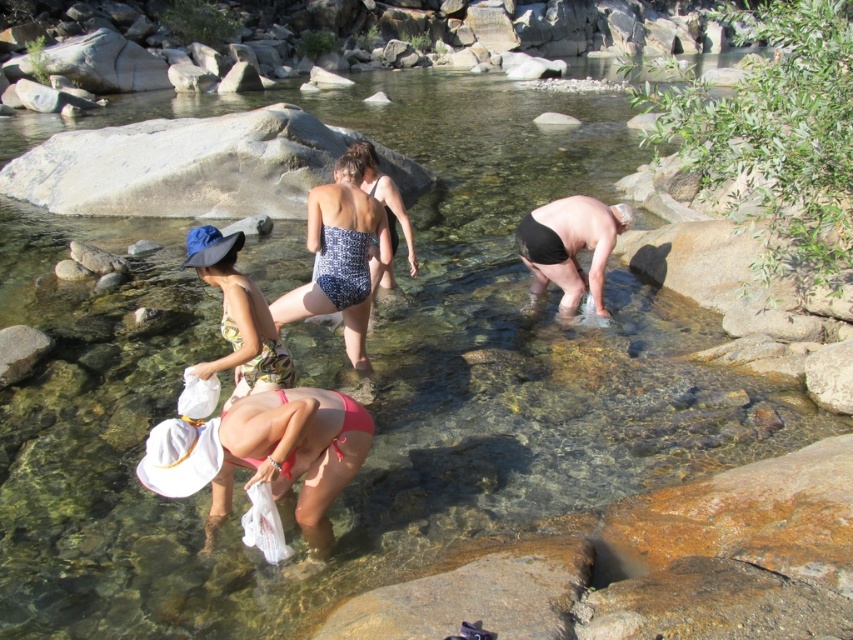
You are a swimmer who wants to move from the pink fabric bikini at lower center to the smooth gray rock at lower left. Given that you can swim 1 foot per second, how long will it take you to reach the rock?

The distance between the pink fabric bikini at lower center and the smooth gray rock at lower left is 12.64 feet. Since you swim at 1 foot per second, it will take approximately 12.64 seconds to reach the rock.

You are a photographer trying to capture both the patterned fabric swimsuit at center and the printed fabric swimsuit at center in a single shot. Which swimsuit will appear bigger in the photo?

The patterned fabric swimsuit at center will appear bigger in the photo because it is larger in size than the printed fabric swimsuit at center.